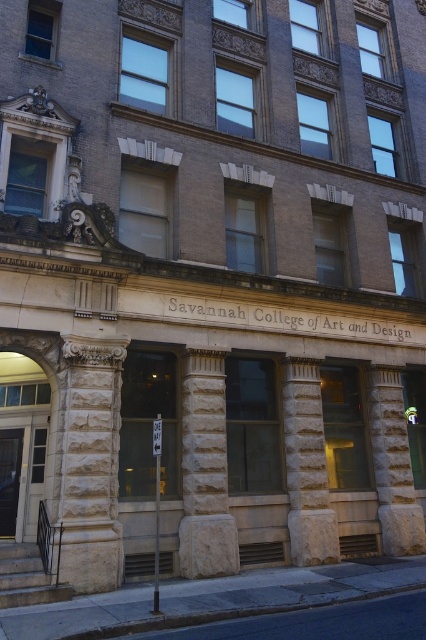
You are an architect analyzing the building facade. You notice the stone textured column at left and the white stone column at center. Which column has a greater width?

The stone textured column at left has a greater width than the white stone column at center.

In the scene shown: You are an architect examining the Savannah College of Art and Design building. You notice two columns, the white stone column at center and the gray stone column at center. Which one is located above the other?

The white stone column at center is positioned over the gray stone column at center, meaning it is located above the other.